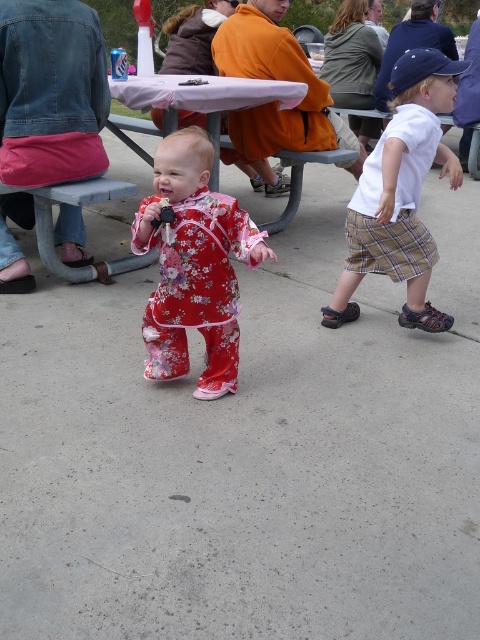
Question: Among these points, which one is farthest from the camera?

Choices:
 (A) (233, 240)
 (B) (172, 100)
 (C) (379, 179)

Answer: (B)

Question: Is floral cotton outfit at center below white plastic picnic table at center?

Choices:
 (A) no
 (B) yes

Answer: (B)

Question: Which point is closer to the camera taking this photo?

Choices:
 (A) (111, 116)
 (B) (139, 205)

Answer: (B)

Question: Is white cotton shirt at right smaller than white plastic picnic table at center?

Choices:
 (A) yes
 (B) no

Answer: (A)

Question: Does floral cotton outfit at center have a lesser width compared to white plastic picnic table at center?

Choices:
 (A) yes
 (B) no

Answer: (A)

Question: Which object is positioned farthest from the white plastic picnic table at center?

Choices:
 (A) floral cotton outfit at center
 (B) white cotton shirt at right

Answer: (A)